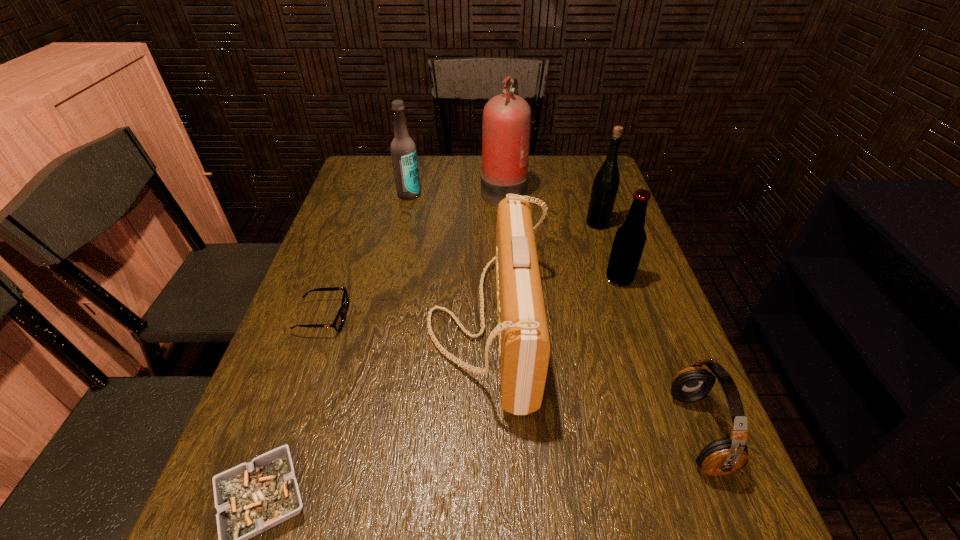
You are a GUI agent. You are given a task and a screenshot of the screen. Output one action in this format:
    pyautogui.click(x=<x>, y=<y>)
    Task: Click on the free space that satisfies the following two spatial constraints: 1. on the back side of the shortest beer bottle; 2. at the nozzle of the tallest object
    
    Given the screenshot: What is the action you would take?
    pyautogui.click(x=589, y=189)

This screenshot has width=960, height=540. In order to click on vacant area in the image that satisfies the following two spatial constraints: 1. at the nozzle of the fire extinguisher; 2. on the label of the third object from left to right in this screenshot , I will do `click(504, 194)`.